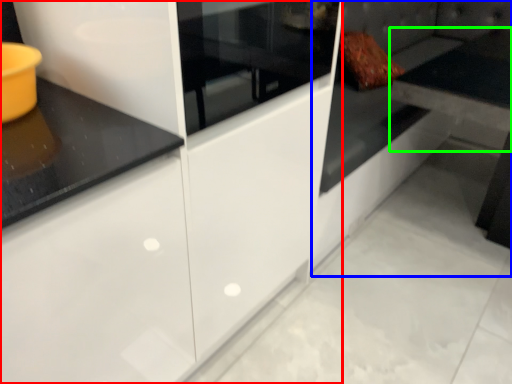
Question: Based on their relative distances, which object is nearer to cabinetry (highlighted by a red box)? Choose from couch (highlighted by a blue box) and table (highlighted by a green box).

Choices:
 (A) couch
 (B) table

Answer: (A)